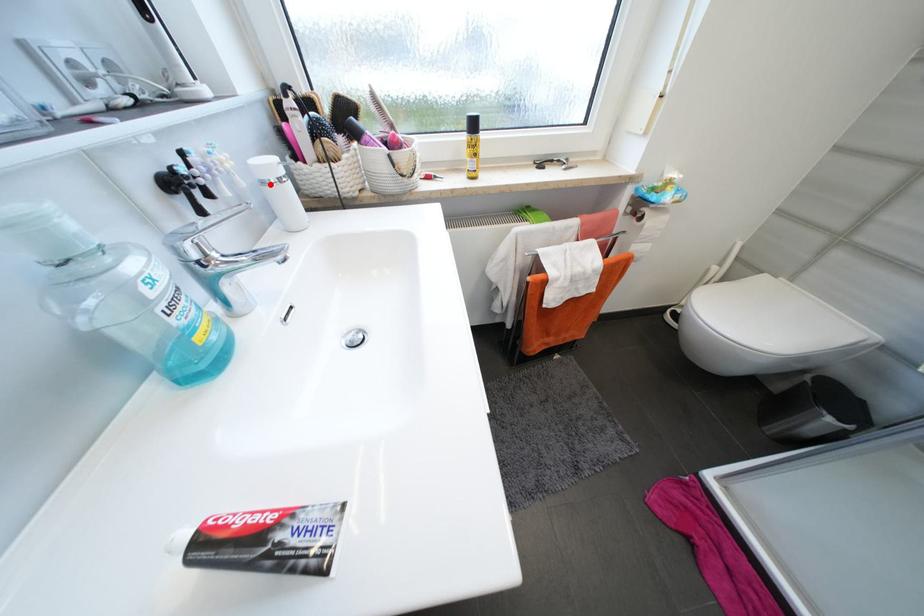
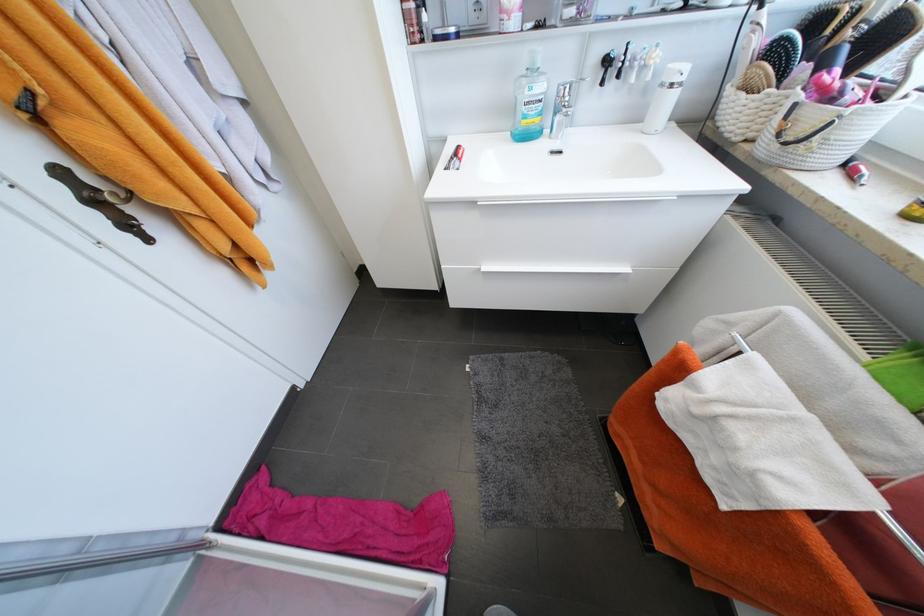
Question: A red point is marked in image1. In image2, is the corresponding 3D point closer to the camera or farther? Reply with the corresponding letter.

Choices:
 (A) The corresponding 3D point is closer.
 (B) The corresponding 3D point is farther.

Answer: (B)